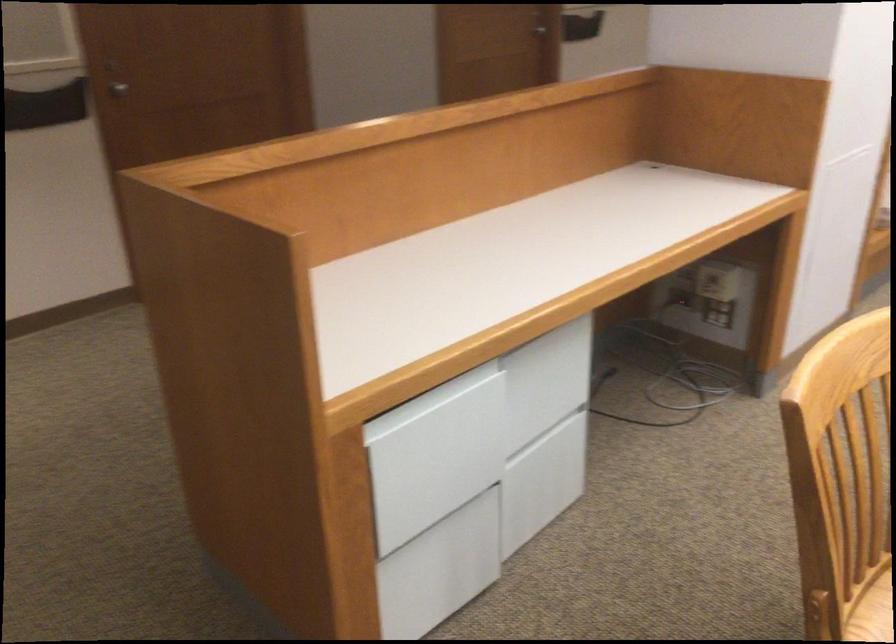
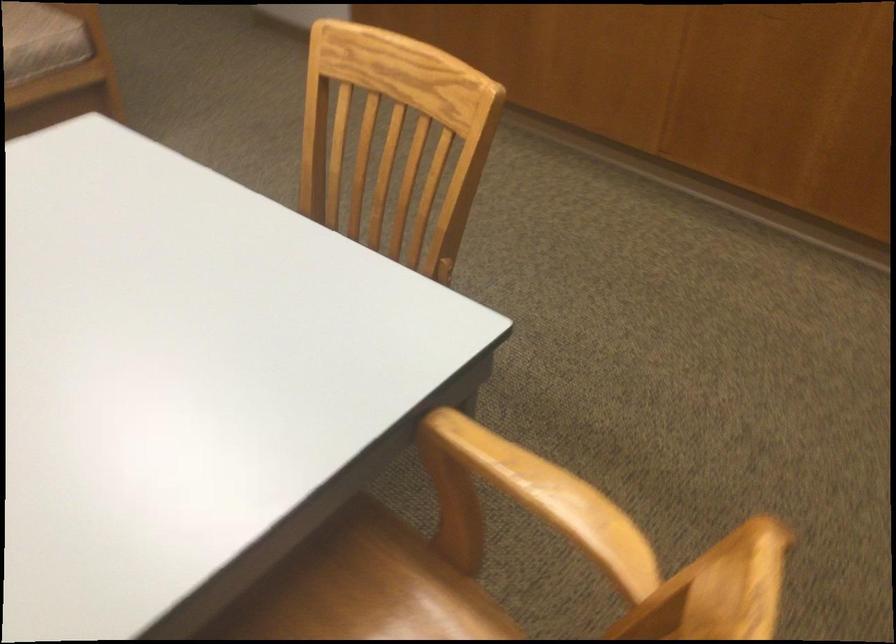
Question: In a continuous first-person perspective shot, in which direction is the camera moving?

Choices:
 (A) Left
 (B) Right
 (C) Forward
 (D) Backward

Answer: (B)